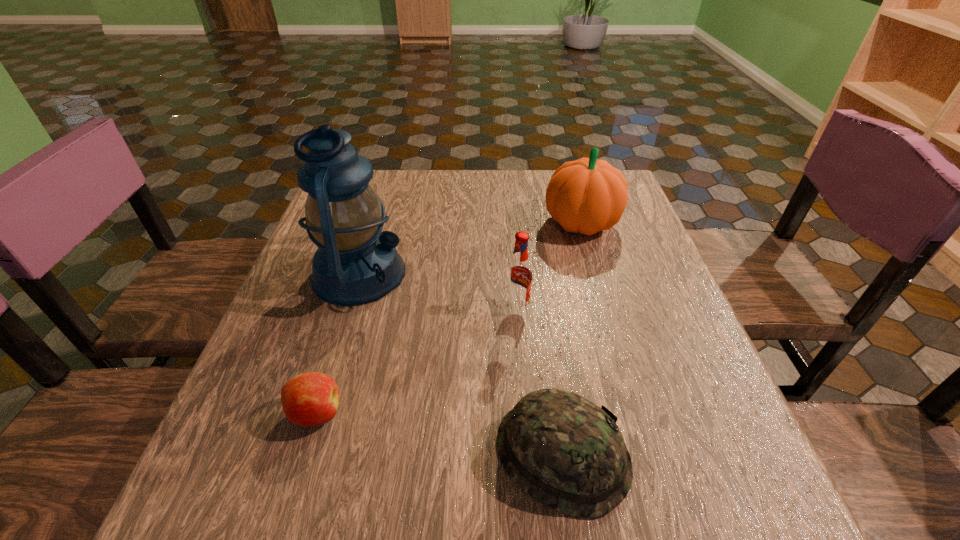
The image size is (960, 540). What are the coordinates of `object at the far edge` in the screenshot? It's located at (585, 196).

I want to click on object that is positioned at the near edge, so click(566, 452).

Locate an element on the screen. lantern located in the left edge section of the desktop is located at coordinates (355, 263).

Image resolution: width=960 pixels, height=540 pixels. Find the location of `apple present at the left edge`. apple present at the left edge is located at coordinates (310, 399).

The width and height of the screenshot is (960, 540). Identify the location of object that is at the right edge. (585, 196).

The height and width of the screenshot is (540, 960). What are the coordinates of `object at the far right corner` in the screenshot? It's located at (585, 196).

Find the location of a particular element. free region at the far edge of the desktop is located at coordinates (453, 190).

In order to click on free space at the near edge in this screenshot , I will do `click(545, 528)`.

The width and height of the screenshot is (960, 540). In the image, there is a desktop. In order to click on blank space at the left edge in this screenshot , I will do [x=311, y=256].

The image size is (960, 540). In order to click on free space at the right edge of the desktop in this screenshot , I will do `click(636, 356)`.